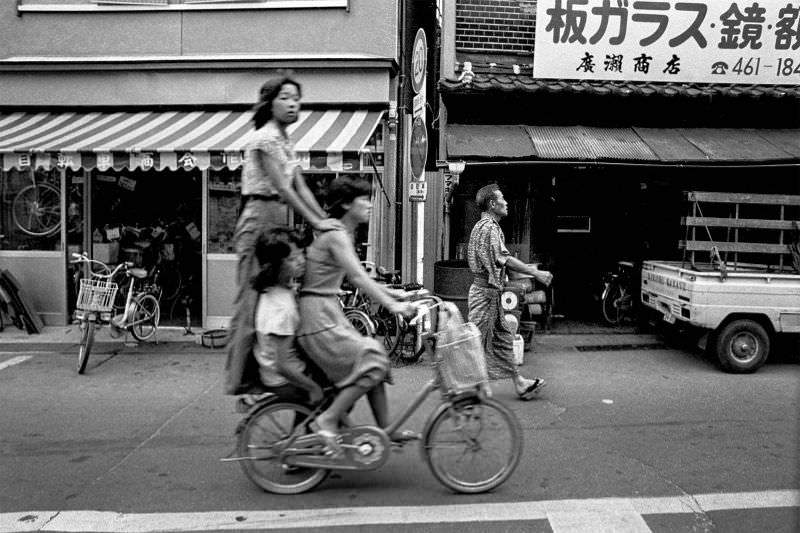
At what (x,y) coordinates should I click in order to perform the action: click on slipper. Please return your answer as a coordinate pair (x, y). The image size is (800, 533). Looking at the image, I should click on (540, 383).